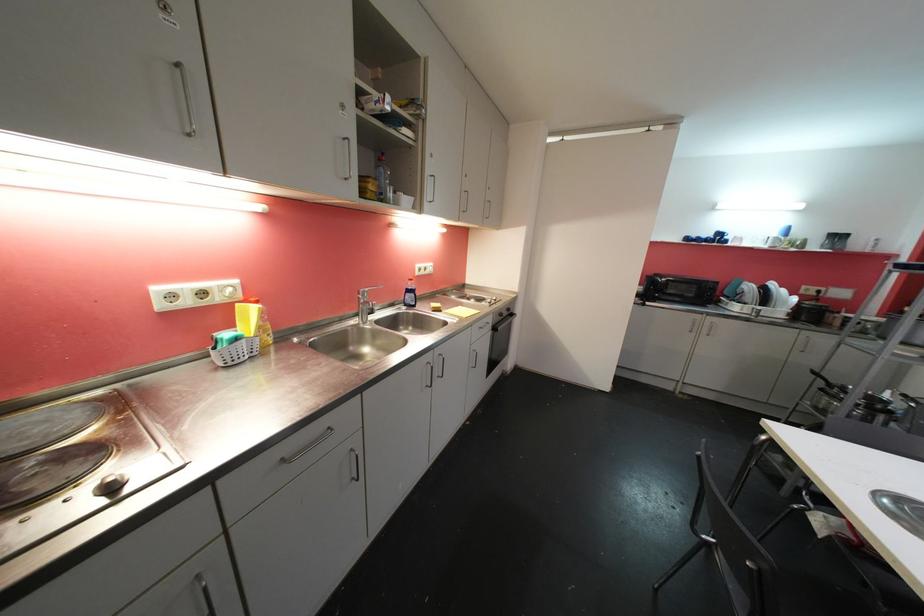
At what (x,y) coordinates should I click in order to perform the action: click on faucet handle. Please return your answer as a coordinate pair (x, y). Looking at the image, I should click on (363, 305).